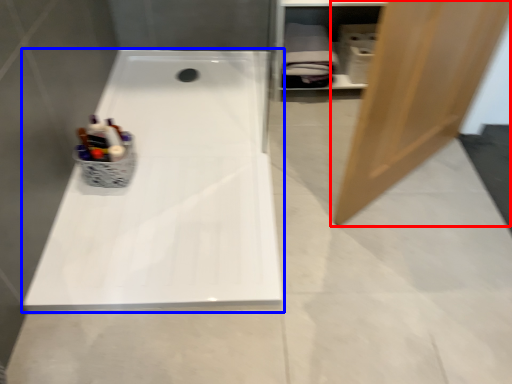
Question: Which point is further to the camera, door (highlighted by a red box) or bathtub (highlighted by a blue box)?

Choices:
 (A) door
 (B) bathtub

Answer: (B)